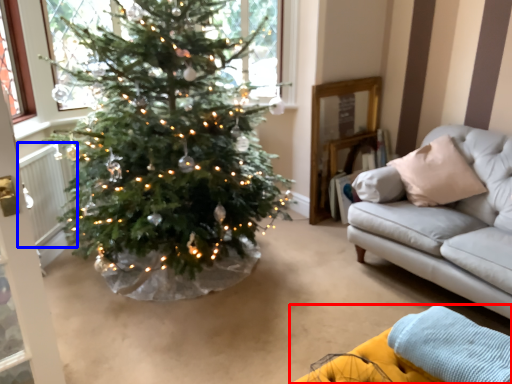
Question: Which object appears farthest to the camera in this image, couch (highlighted by a red box) or radiator (highlighted by a blue box)?

Choices:
 (A) couch
 (B) radiator

Answer: (B)